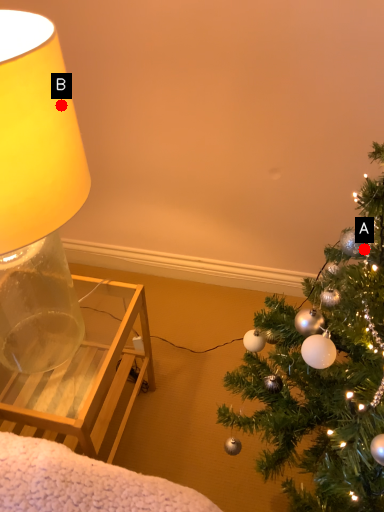
Question: Two points are circled on the image, labeled by A and B beside each circle. Which point is further to the camera?

Choices:
 (A) A is further
 (B) B is further

Answer: (A)